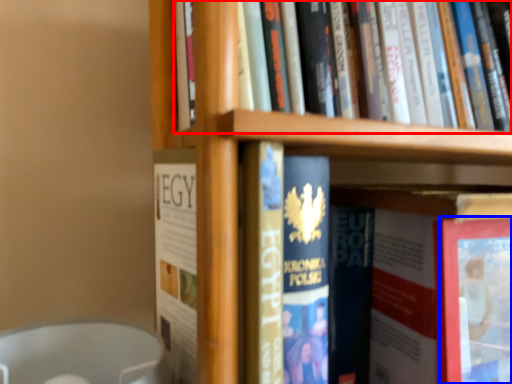
Question: Which object is closer to the camera taking this photo, book (highlighted by a red box) or paperback book (highlighted by a blue box)?

Choices:
 (A) book
 (B) paperback book

Answer: (A)